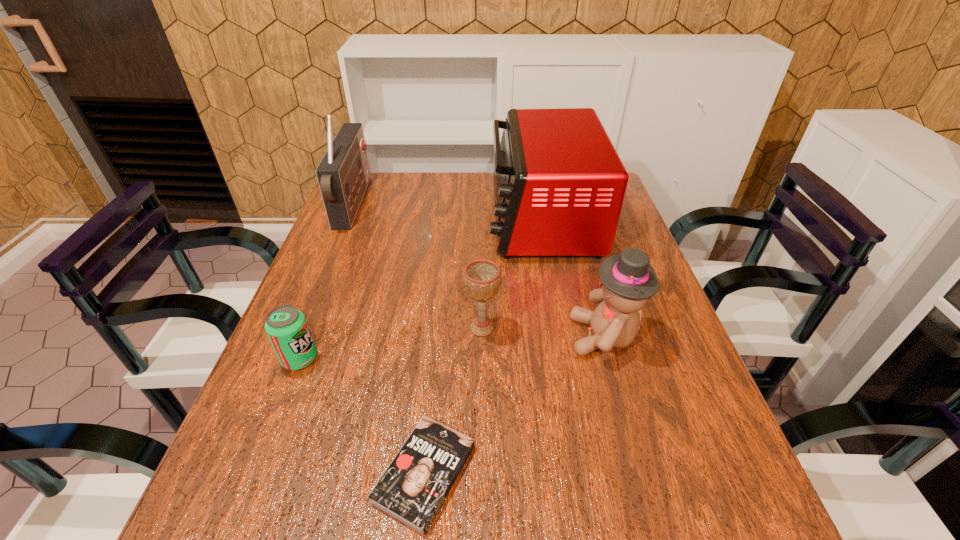
Identify the location of empty location between the fourth tallest object and the rag_doll. (543, 332).

Identify the location of vacant space that is in between the radio receiver and the fourth tallest object. Image resolution: width=960 pixels, height=540 pixels. (418, 266).

Identify the location of vacant space that's between the third shortest object and the nearest object. This screenshot has width=960, height=540. (453, 401).

Find the location of a particular element. This screenshot has height=540, width=960. vacant area that lies between the nearest object and the third tallest object is located at coordinates (515, 405).

I want to click on free spot between the toaster oven and the nearest object, so click(x=483, y=346).

I want to click on vacant space that's between the book and the second shortest object, so click(x=362, y=416).

Locate an element on the screen. free spot between the nearest object and the chalice is located at coordinates (453, 401).

Find the location of a particular element. empty space that is in between the nearest object and the fifth tallest object is located at coordinates (362, 416).

Locate an element on the screen. Image resolution: width=960 pixels, height=540 pixels. free space between the nearest object and the rag_doll is located at coordinates (515, 405).

Where is `object that is the nearest to the radio receiver`? The height and width of the screenshot is (540, 960). object that is the nearest to the radio receiver is located at coordinates (559, 185).